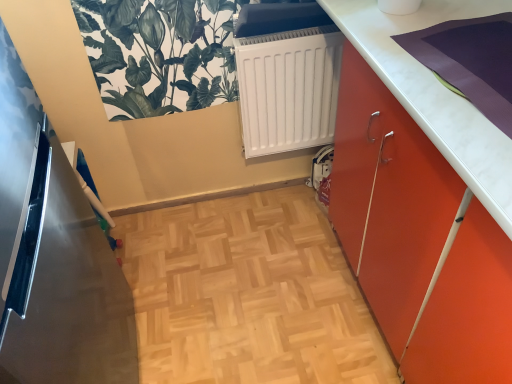
Question: Is white matte radiator at center directly adjacent to green leafy plant at upper left?

Choices:
 (A) no
 (B) yes

Answer: (A)

Question: From a real-world perspective, is white matte radiator at center under green leafy plant at upper left?

Choices:
 (A) no
 (B) yes

Answer: (B)

Question: Does white matte radiator at center come behind green leafy plant at upper left?

Choices:
 (A) yes
 (B) no

Answer: (A)

Question: Is white matte radiator at center shorter than green leafy plant at upper left?

Choices:
 (A) no
 (B) yes

Answer: (A)

Question: Is white matte radiator at center located outside green leafy plant at upper left?

Choices:
 (A) no
 (B) yes

Answer: (B)

Question: Is metallic refrigerator at left wider or thinner than orange matte cabinet at right?

Choices:
 (A) wide
 (B) thin

Answer: (A)

Question: Which is correct: metallic refrigerator at left is inside orange matte cabinet at right, or outside of it?

Choices:
 (A) outside
 (B) inside

Answer: (A)

Question: Would you say metallic refrigerator at left is to the left or to the right of orange matte cabinet at right in the picture?

Choices:
 (A) left
 (B) right

Answer: (A)

Question: From the image's perspective, is metallic refrigerator at left located above or below orange matte cabinet at right?

Choices:
 (A) below
 (B) above

Answer: (A)

Question: In terms of height, does green leafy plant at upper left look taller or shorter compared to metallic refrigerator at left?

Choices:
 (A) tall
 (B) short

Answer: (B)

Question: Do you think green leafy plant at upper left is within metallic refrigerator at left, or outside of it?

Choices:
 (A) outside
 (B) inside

Answer: (A)

Question: From the image's perspective, is green leafy plant at upper left located above or below metallic refrigerator at left?

Choices:
 (A) below
 (B) above

Answer: (B)

Question: From a real-world perspective, is green leafy plant at upper left positioned above or below metallic refrigerator at left?

Choices:
 (A) above
 (B) below

Answer: (A)

Question: In terms of width, does metallic refrigerator at left look wider or thinner when compared to white matte radiator at center?

Choices:
 (A) thin
 (B) wide

Answer: (B)

Question: From a real-world perspective, is metallic refrigerator at left positioned above or below white matte radiator at center?

Choices:
 (A) below
 (B) above

Answer: (B)